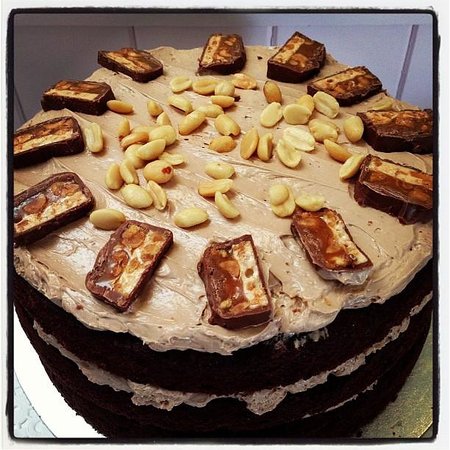
At what (x,y) coordinates should I click in order to perform the action: click on wall. Please return your answer as a coordinate pair (x, y). Looking at the image, I should click on (364, 47).